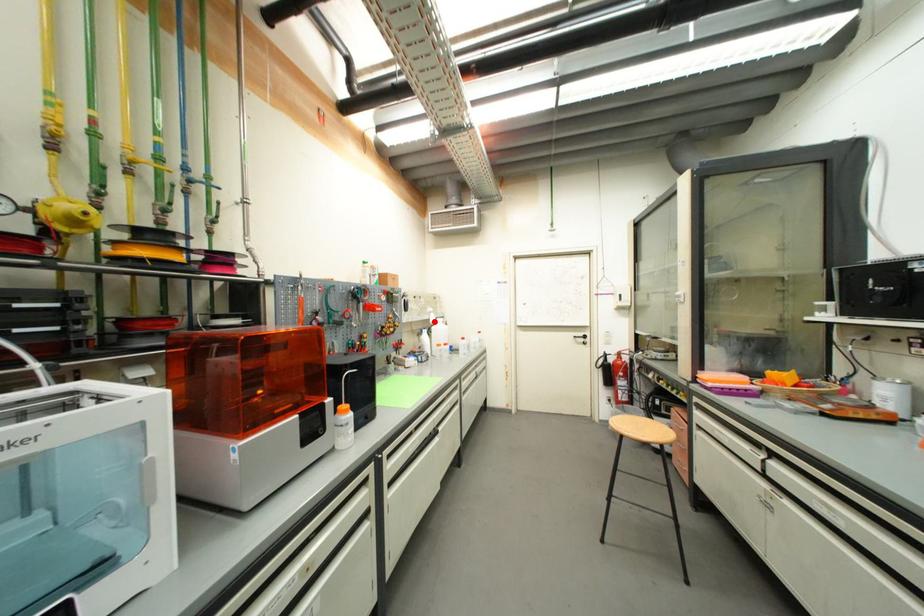
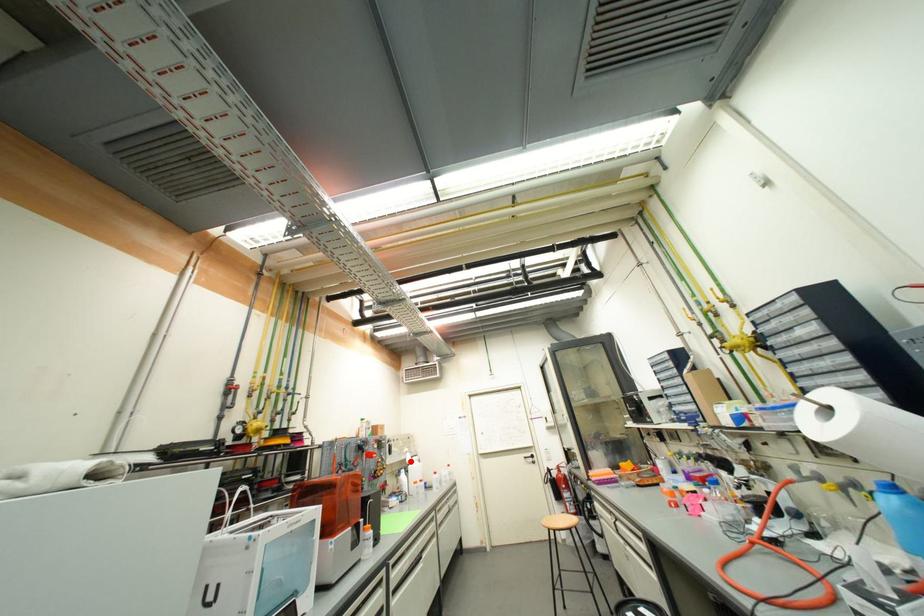
I am providing you with two images of the same scene from different viewpoints. A red point is marked on the first image and another point is marked on the second image. Is the red point in image1 aligned with the point shown in image2?

Yes